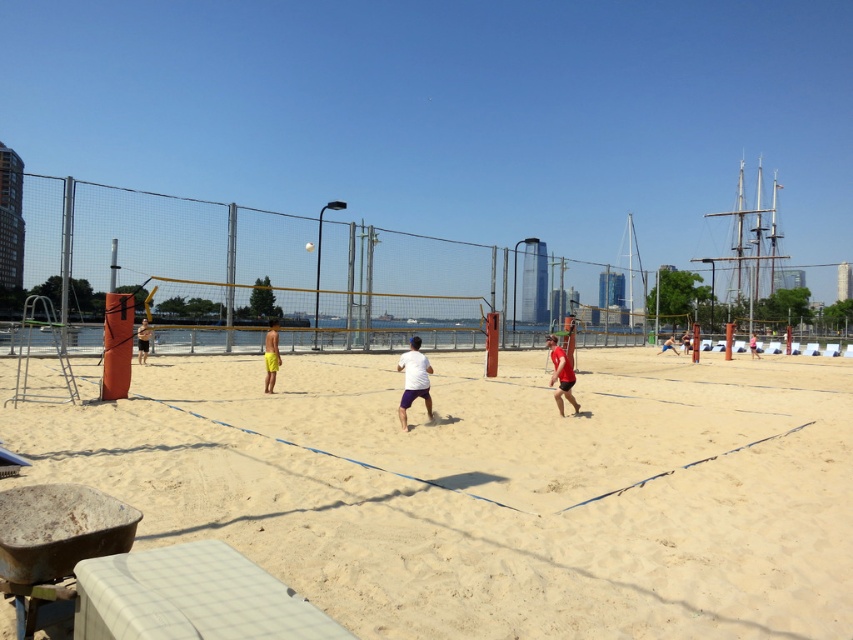
Between white sand at center and matte white shirt at center, which one has less height?

Standing shorter between the two is matte white shirt at center.

Between white sand at center and matte white shirt at center, which one appears on the left side from the viewer's perspective?

white sand at center

Which is behind, point (363, 628) or point (671, 337)?

The point (671, 337) is more distant.

Identify the location of white sand at center. (492, 488).

Who is more forward, (431, 413) or (683, 337)?

Point (431, 413)

You are a GUI agent. You are given a task and a screenshot of the screen. Output one action in this format:
    pyautogui.click(x=<x>, y=<y>)
    Task: Click on the white matte shirt at center
    
    Given the screenshot: What is the action you would take?
    pyautogui.click(x=415, y=380)

Where is `white matte shirt at center`? white matte shirt at center is located at coordinates (415, 380).

The image size is (853, 640). What do you see at coordinates (492, 488) in the screenshot?
I see `white sand at center` at bounding box center [492, 488].

Between white sand at center and white fabric shirt at center, which one has more height?

With more height is white fabric shirt at center.

What do you see at coordinates (492, 488) in the screenshot? This screenshot has width=853, height=640. I see `white sand at center` at bounding box center [492, 488].

Locate an element on the screen. Image resolution: width=853 pixels, height=640 pixels. white sand at center is located at coordinates (492, 488).